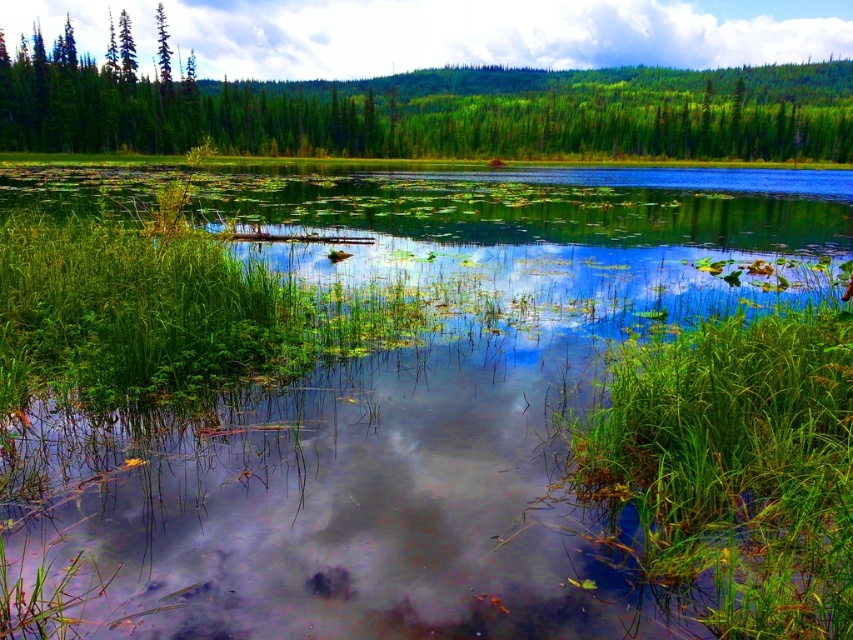
Question: Among these objects, which one is nearest to the camera?

Choices:
 (A) transparent water at center
 (B) white fluffy cloud at upper center
 (C) green grassy at center

Answer: (C)

Question: Observing the image, what is the correct spatial positioning of green matte tree at upper center in reference to green matte tree at upper left?

Choices:
 (A) right
 (B) left

Answer: (A)

Question: Is green grassy at center thinner than green matte tree at upper left?

Choices:
 (A) no
 (B) yes

Answer: (B)

Question: Considering the real-world distances, which object is closest to the transparent water at center?

Choices:
 (A) green grassy at center
 (B) green matte tree at upper left
 (C) green matte tree at upper center

Answer: (A)

Question: From the image, what is the correct spatial relationship of transparent water at center in relation to green grassy at center?

Choices:
 (A) right
 (B) left

Answer: (B)

Question: Estimate the real-world distances between objects in this image. Which object is farther from the green matte tree at upper left?

Choices:
 (A) transparent water at center
 (B) white fluffy cloud at upper center
 (C) green grassy at center
 (D) green matte tree at upper center

Answer: (C)